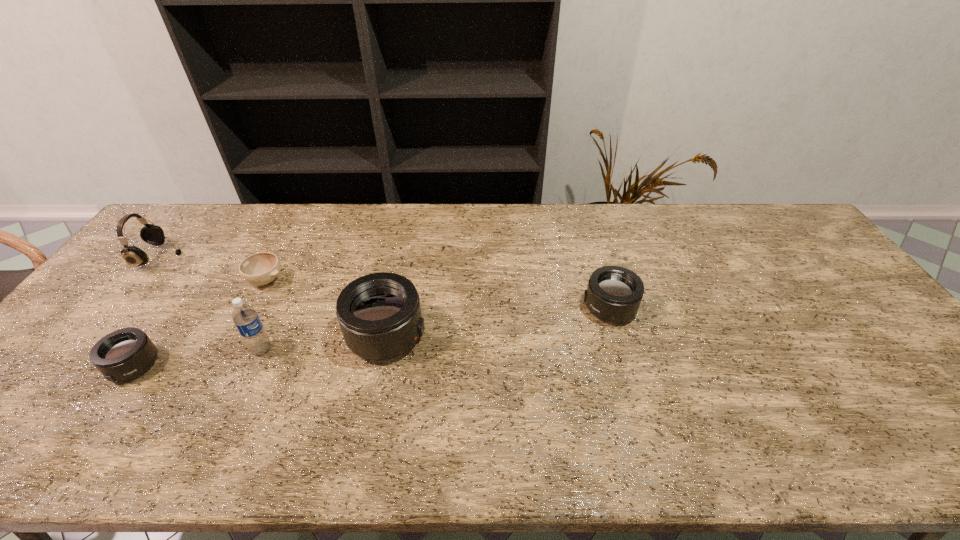
Locate an element on the screen. Image resolution: width=960 pixels, height=540 pixels. vacant space situated 0.250m on the side of the rightmost object with brand markings and control switches is located at coordinates [x=493, y=308].

Where is `vacant space located 0.050m on the side of the rightmost object with brand markings and control switches`? This screenshot has height=540, width=960. vacant space located 0.050m on the side of the rightmost object with brand markings and control switches is located at coordinates (564, 308).

This screenshot has width=960, height=540. Identify the location of vacant space located on the side of the rightmost object with brand markings and control switches. (511, 308).

Identify the location of blank area located on the right of the shortest object. (400, 280).

The width and height of the screenshot is (960, 540). Identify the location of vacant space situated with the microphone on the side of the leftmost object. (237, 257).

The width and height of the screenshot is (960, 540). What are the coordinates of `free space located 0.210m on the back of the water bottle` in the screenshot? It's located at (291, 286).

Find the location of a particular element. The height and width of the screenshot is (540, 960). object present at the far edge is located at coordinates (151, 234).

Image resolution: width=960 pixels, height=540 pixels. What are the coordinates of `object at the near edge` in the screenshot? It's located at (124, 354).

The height and width of the screenshot is (540, 960). I want to click on object that is at the left edge, so click(151, 234).

Locate an element on the screen. object located at the far left corner is located at coordinates (151, 234).